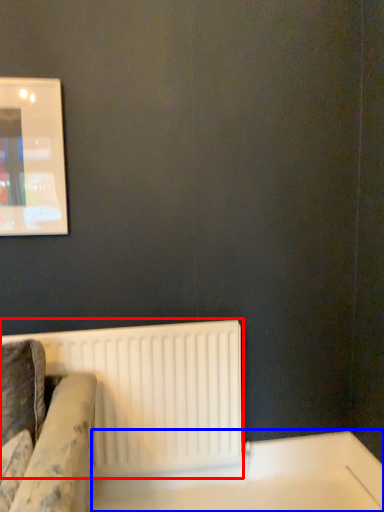
Question: Among these objects, which one is nearest to the camera, radiator (highlighted by a red box) or table (highlighted by a blue box)?

Choices:
 (A) radiator
 (B) table

Answer: (B)